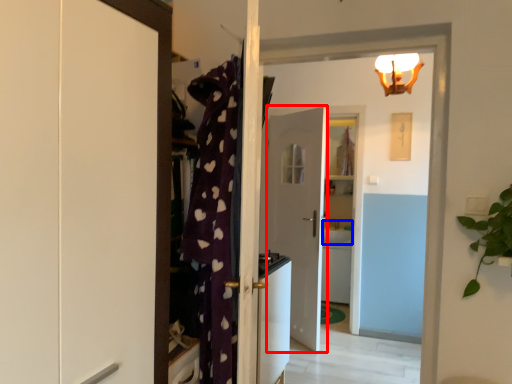
Question: Among these objects, which one is farthest to the camera, door (highlighted by a red box) or sink (highlighted by a blue box)?

Choices:
 (A) door
 (B) sink

Answer: (B)